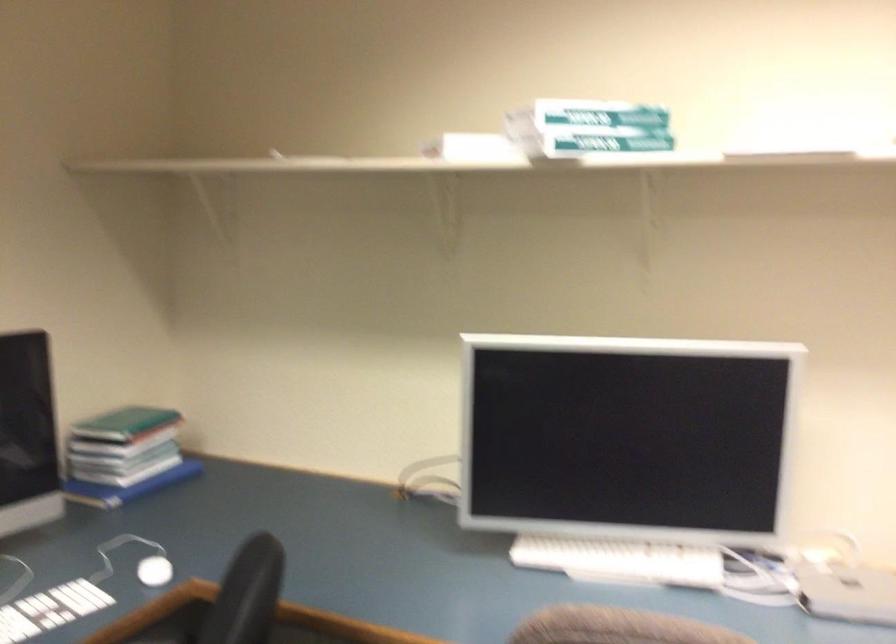
Find the location of a particular element. This screenshot has height=644, width=896. silver box is located at coordinates (846, 591).